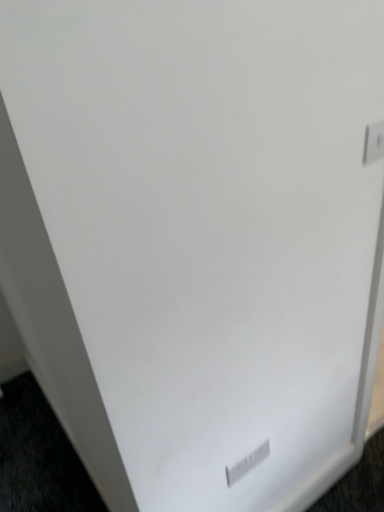
Question: Is white plastic electric outlet at lower center, arranged as the 1th electric outlet when ordered from the bottom, inside the boundaries of white plastic electric outlet at upper right, positioned as the second electric outlet in left-to-right order, or outside?

Choices:
 (A) outside
 (B) inside

Answer: (A)

Question: From their relative heights in the image, would you say white plastic electric outlet at lower center, acting as the first electric outlet starting from the back, is taller or shorter than white plastic electric outlet at upper right, the second electric outlet viewed from the back?

Choices:
 (A) tall
 (B) short

Answer: (A)

Question: Does point 231,475 appear closer or farther from the camera than point 372,155?

Choices:
 (A) farther
 (B) closer

Answer: (A)

Question: From a real-world perspective, is white plastic electric outlet at upper right, positioned as the second electric outlet in left-to-right order, positioned above or below white plastic electric outlet at lower center, which is counted as the second electric outlet, starting from the top?

Choices:
 (A) below
 (B) above

Answer: (B)

Question: From their relative heights in the image, would you say white plastic electric outlet at upper right, the 1th electric outlet in the right-to-left sequence, is taller or shorter than white plastic electric outlet at lower center, which is counted as the second electric outlet, starting from the top?

Choices:
 (A) short
 (B) tall

Answer: (A)

Question: In the image, is white plastic electric outlet at upper right, the second electric outlet viewed from the back, positioned in front of or behind white plastic electric outlet at lower center, positioned as the 1th electric outlet in left-to-right order?

Choices:
 (A) front
 (B) behind

Answer: (A)

Question: Considering the positions of white plastic electric outlet at upper right, the 1th electric outlet in the right-to-left sequence, and white plastic electric outlet at lower center, acting as the first electric outlet starting from the back, in the image, is white plastic electric outlet at upper right, the 1th electric outlet in the right-to-left sequence, wider or thinner than white plastic electric outlet at lower center, acting as the first electric outlet starting from the back,?

Choices:
 (A) wide
 (B) thin

Answer: (B)